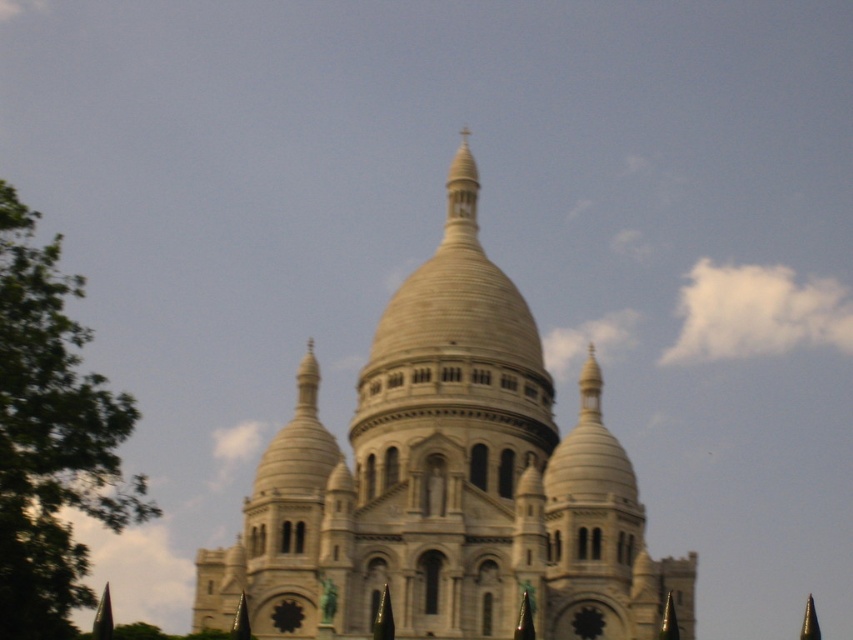
Is point (691, 586) in front of point (105, 500)?

That is False.

Which is more to the right, white stone church at center or green leafy tree at left?

white stone church at center is more to the right.

At what (x,y) coordinates should I click in order to perform the action: click on white stone church at center. Please return your answer as a coordinate pair (x, y). This screenshot has width=853, height=640. Looking at the image, I should click on (445, 481).